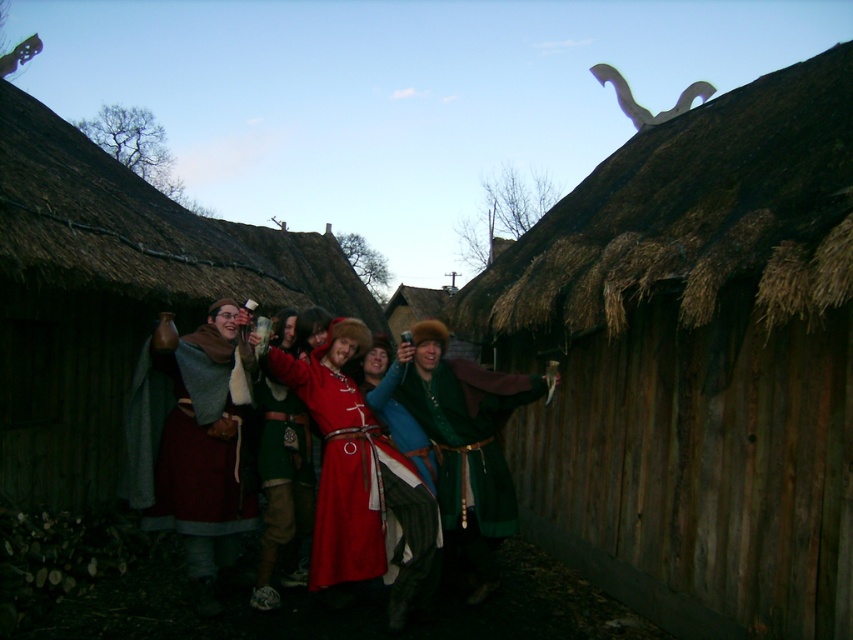
You are a photographer at a historical event. You need to capture a group photo of the thatched straw hut at center and the green velvet robe at center. Which object is wider so that it can be framed better in the shot?

The thatched straw hut at center is wider than the green velvet robe at center, so it can be framed better in the shot.

You are a photographer at the historical event. You want to take a photo of the matte woolen cloak at center. Where should you position your camera to capture it in the frame?

The matte woolen cloak at center is located at the 2D coordinates point (190,445), so position the camera to focus on that point to capture it in the frame.

You are a photographer trying to capture a closeup of the matte woolen cloak at center. Given that your camera has a focus range of 0.6 meters to 0.7 meters, can you adjust your position to focus on it?

The matte woolen cloak at center is positioned at point 0.697, so adjusting your position to 0.7 meters would allow the camera to focus on it within the focus range.